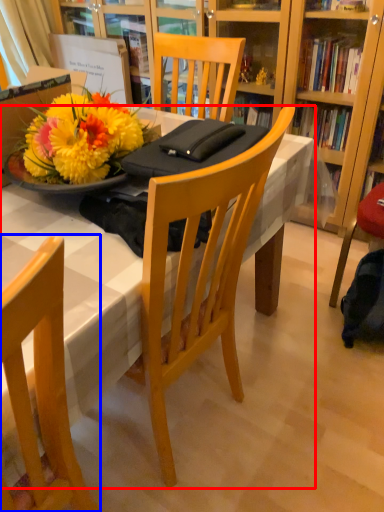
Question: Which point is closer to the camera, desk (highlighted by a red box) or chair (highlighted by a blue box)?

Choices:
 (A) desk
 (B) chair

Answer: (B)